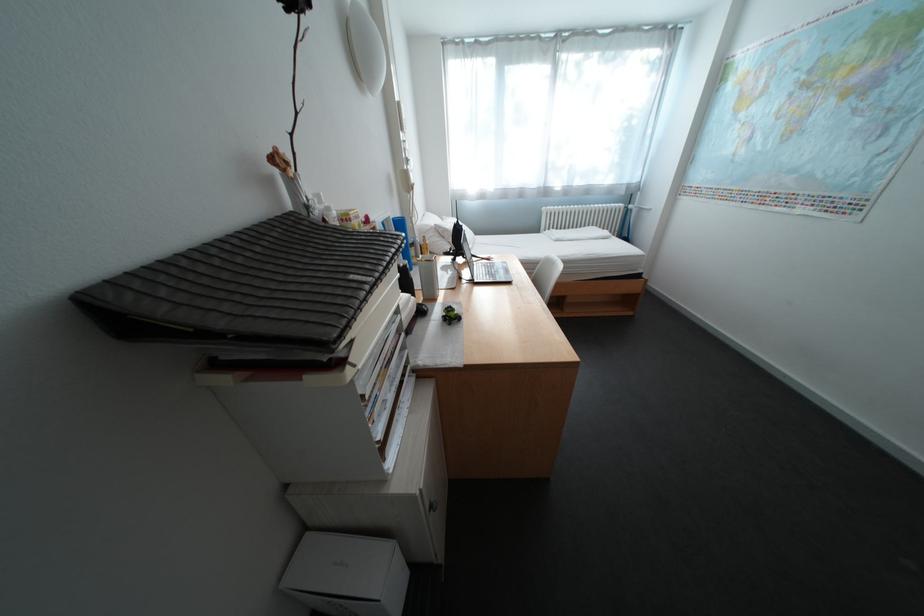
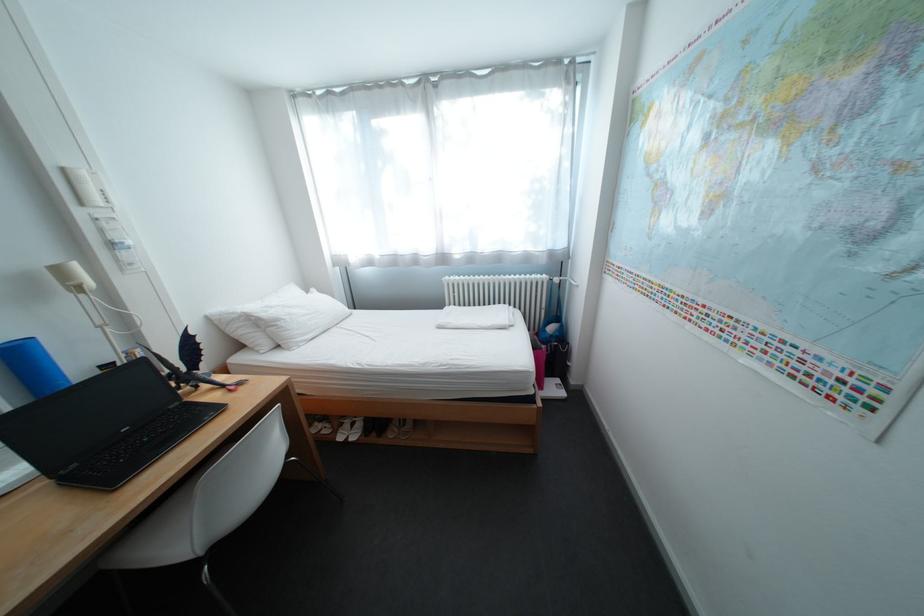
Where in the second image is the point corresponding to point 555,209 from the first image?

(459, 278)